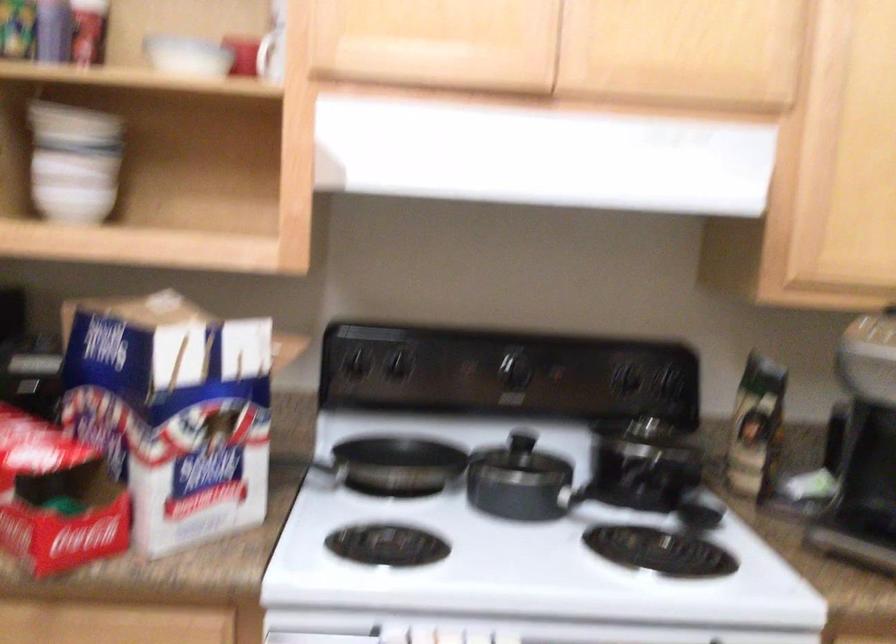
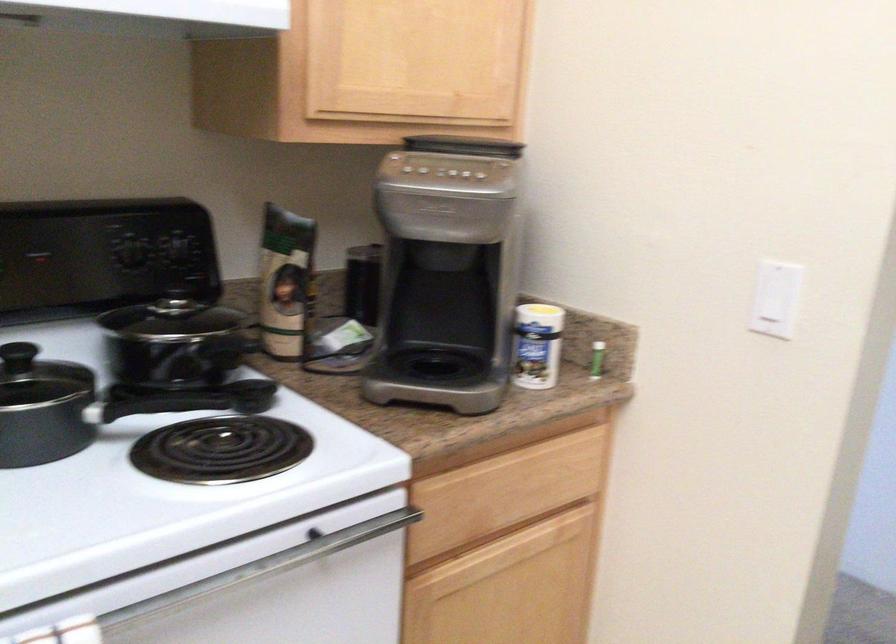
Locate, in the second image, the point that corresponds to point 631,506 in the first image.

(194, 400)